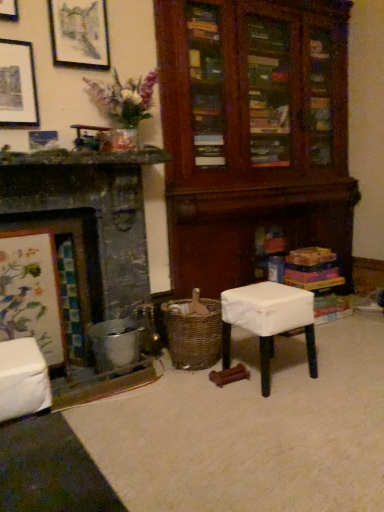
Where is `free space to the right of white fabric-covered stool at center`? The image size is (384, 512). free space to the right of white fabric-covered stool at center is located at coordinates (326, 374).